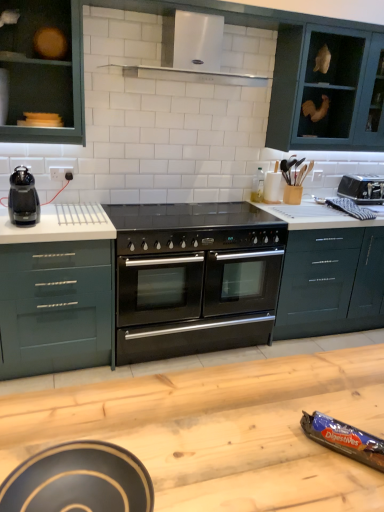
This screenshot has height=512, width=384. Identify the location of vacant space underneath matte black bowl at lower left, arranged as the 1th appliance when viewed from the front (from a real-world perspective). (79, 492).